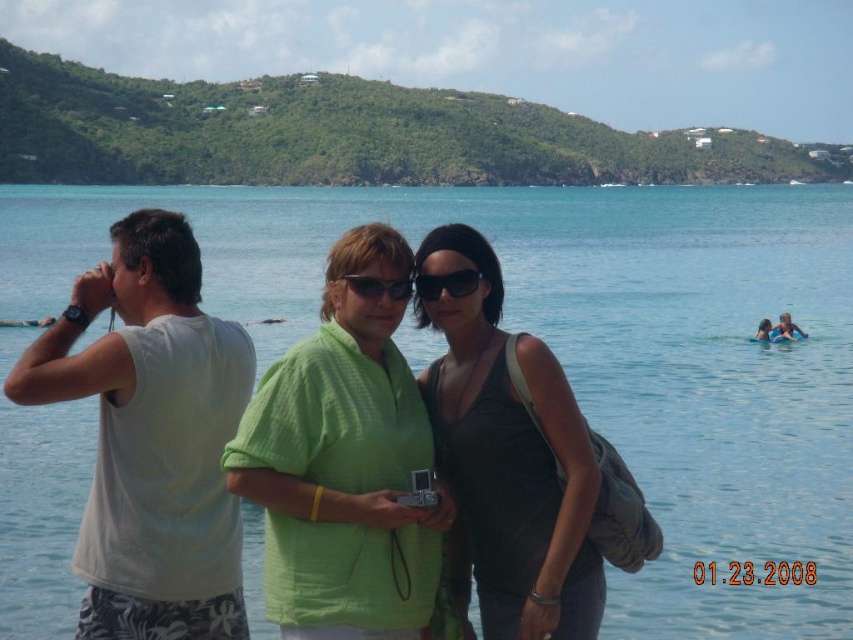
Does black matte tank top at center lie in front of black plastic sunglasses at center?

That is True.

Based on the photo, can you confirm if black matte tank top at center is wider than black plastic sunglasses at center?

Indeed, black matte tank top at center has a greater width compared to black plastic sunglasses at center.

Measure the distance between point (415,268) and camera.

Point (415,268) and camera are 212.55 feet apart from each other.

Find the location of a particular element. black matte tank top at center is located at coordinates (508, 460).

Consider the image. Who is positioned more to the right, clear blue water at center or green matte sunglasses at center?

Positioned to the right is clear blue water at center.

Is clear blue water at center below green matte sunglasses at center?

No, clear blue water at center is not below green matte sunglasses at center.

Which is in front, point (705, 250) or point (366, 294)?

Point (366, 294) is more forward.

Find the location of a particular element. Image resolution: width=853 pixels, height=640 pixels. clear blue water at center is located at coordinates (584, 349).

Consider the image. Is clear blue water at center to the right of white cotton shirt at left from the viewer's perspective?

Yes, clear blue water at center is to the right of white cotton shirt at left.

Who is positioned more to the left, clear blue water at center or white cotton shirt at left?

Positioned to the left is white cotton shirt at left.

Measure the distance between clear blue water at center and camera.

A distance of 63.05 meters exists between clear blue water at center and camera.

Where is `clear blue water at center`? This screenshot has width=853, height=640. clear blue water at center is located at coordinates (584, 349).